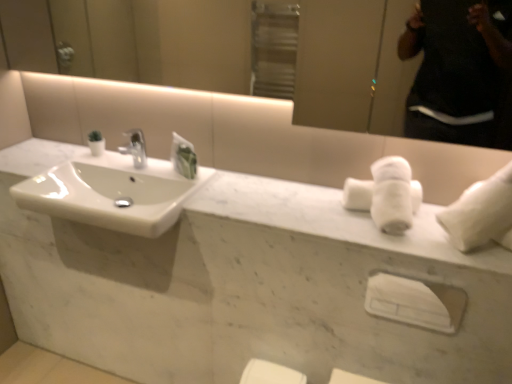
Question: Considering the positions of point (103, 198) and point (425, 317), is point (103, 198) closer or farther from the camera than point (425, 317)?

Choices:
 (A) farther
 (B) closer

Answer: (A)

Question: Looking at their shapes, would you say white glossy sink at left is wider or thinner than white plastic towel bar at center?

Choices:
 (A) wide
 (B) thin

Answer: (A)

Question: Estimate the real-world distances between objects in this image. Which object is closer to the white marble counter top at center?

Choices:
 (A) white glossy sink at left
 (B) white plastic towel bar at center
 (C) white matte towel at right, which is the second bath towel in left-to-right order
 (D) white fluffy bath towel at upper right, the 1th bath towel viewed from the left

Answer: (A)

Question: Which object is positioned farthest from the white fluffy bath towel at upper right, the 1th bath towel viewed from the left?

Choices:
 (A) white plastic towel bar at center
 (B) white matte towel at right, which is the second bath towel in left-to-right order
 (C) white marble counter top at center
 (D) white glossy sink at left

Answer: (D)